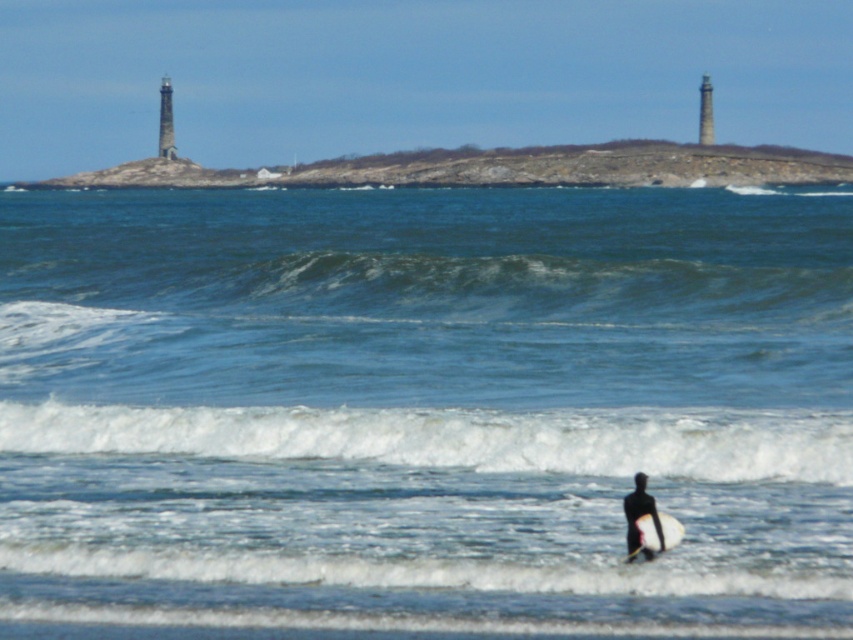
Question: Which object is farther from the camera taking this photo?

Choices:
 (A) blue water at center
 (B) white foamy wave at lower center
 (C) rocky island at center
 (D) white foam surfboard at lower center

Answer: (C)

Question: Which of the following is the farthest from the observer?

Choices:
 (A) (129, 163)
 (B) (140, 426)

Answer: (A)

Question: Does blue water at center have a greater width compared to white foamy wave at lower center?

Choices:
 (A) yes
 (B) no

Answer: (A)

Question: Does blue water at center appear on the right side of rocky island at center?

Choices:
 (A) yes
 (B) no

Answer: (B)

Question: Which is farther from the white foam surfboard at lower center?

Choices:
 (A) blue water at center
 (B) rocky island at center
 (C) white foamy wave at lower center

Answer: (B)

Question: Is white foamy wave at lower center below rocky island at center?

Choices:
 (A) no
 (B) yes

Answer: (B)